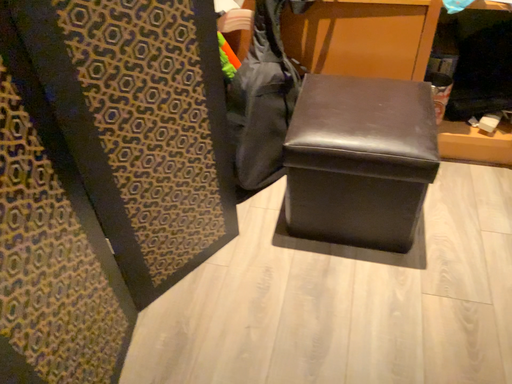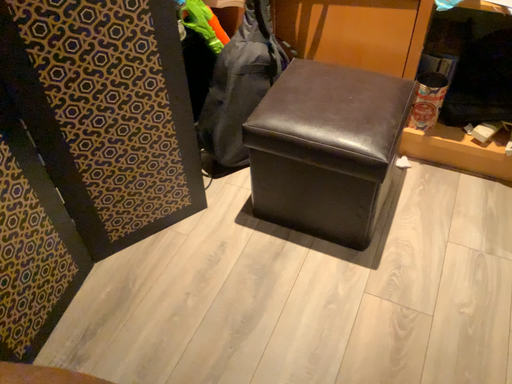
Question: Which way did the camera rotate in the video?

Choices:
 (A) rotated left
 (B) rotated right

Answer: (A)